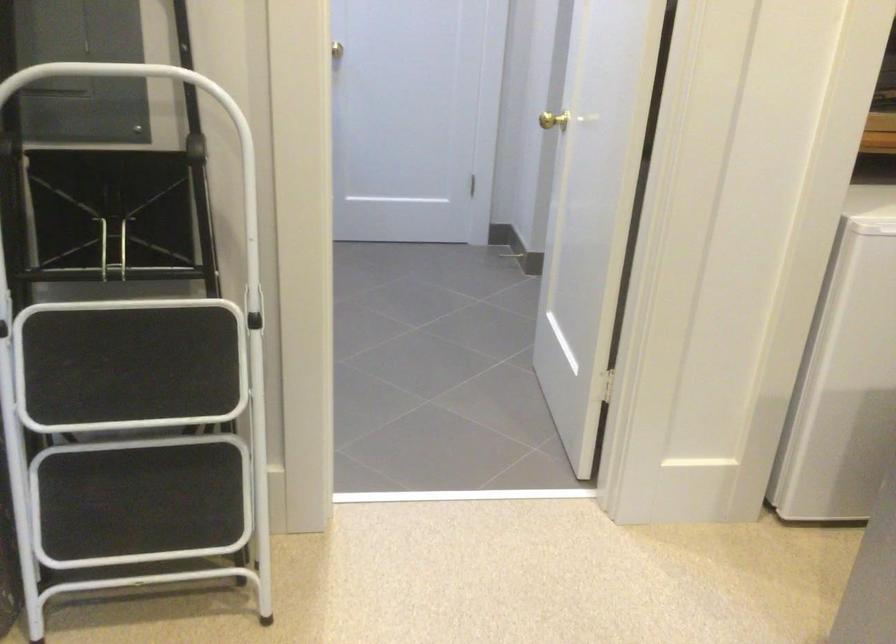
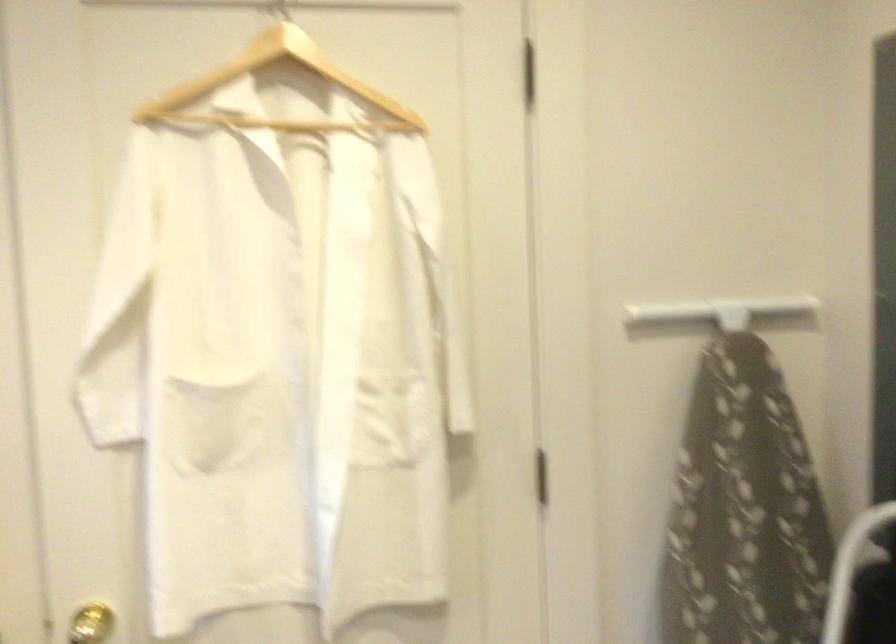
Question: The images are taken continuously from a first-person perspective. In which direction is your viewpoint rotating?

Choices:
 (A) Left
 (B) Right
 (C) Up
 (D) Down

Answer: (A)